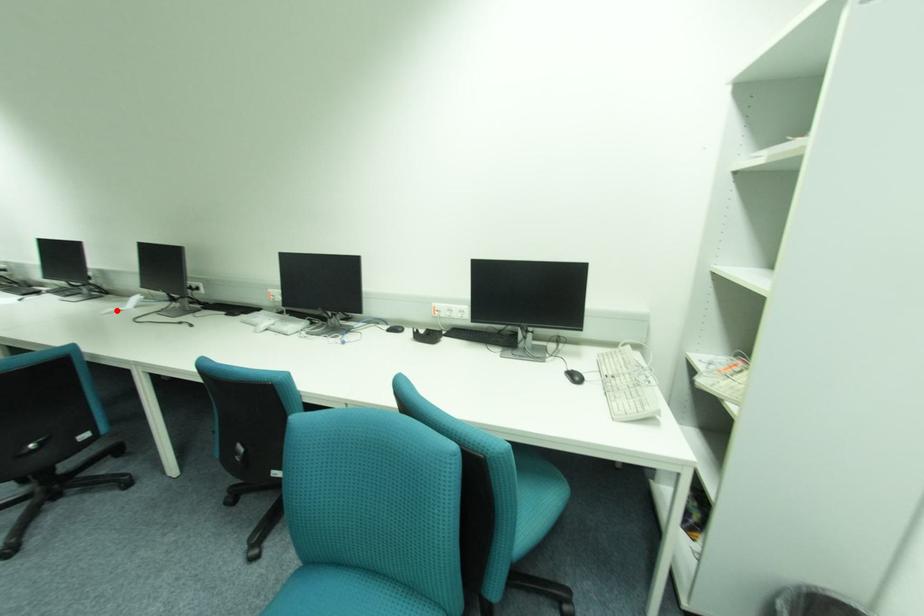
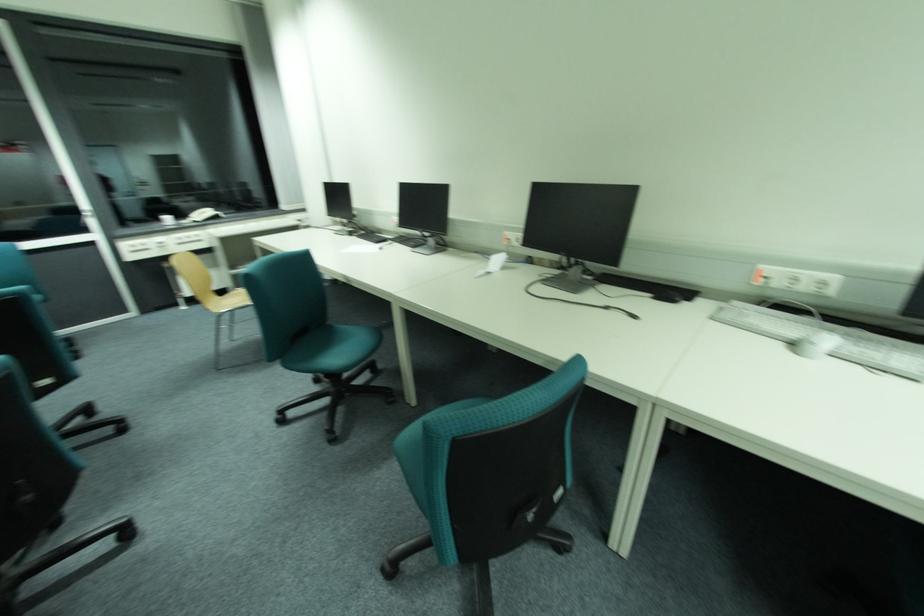
Find the pixel in the second image that matches the highlighted location in the first image.

(487, 272)